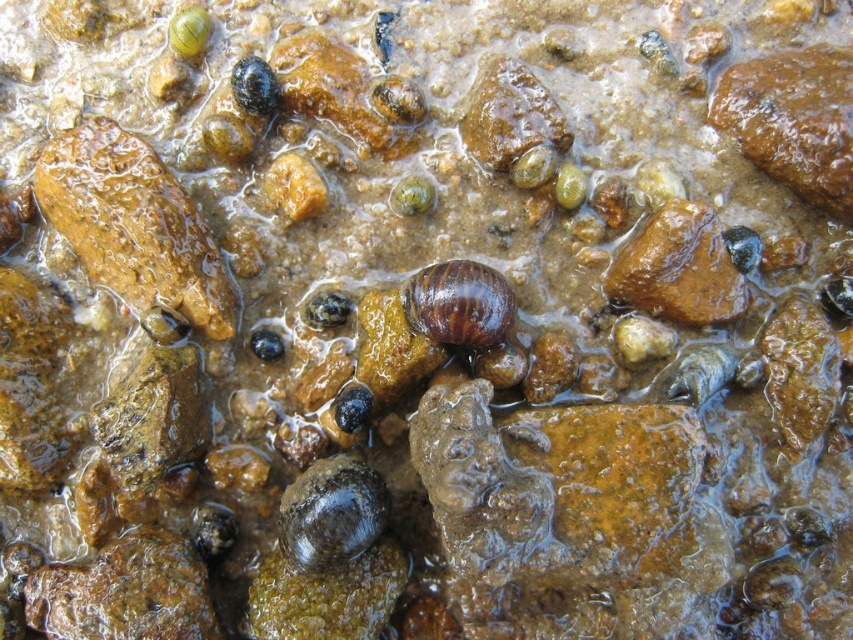
Question: Is shiny dark brown snail at center-left positioned at the back of shiny brown snail at center?

Choices:
 (A) no
 (B) yes

Answer: (A)

Question: Can you confirm if shiny dark brown snail at center-left is positioned to the right of shiny brown snail at center?

Choices:
 (A) no
 (B) yes

Answer: (A)

Question: Can you confirm if shiny dark brown snail at center-left is smaller than shiny brown snail at center?

Choices:
 (A) yes
 (B) no

Answer: (B)

Question: Which point is farther to the camera?

Choices:
 (A) (496, 316)
 (B) (366, 525)

Answer: (A)